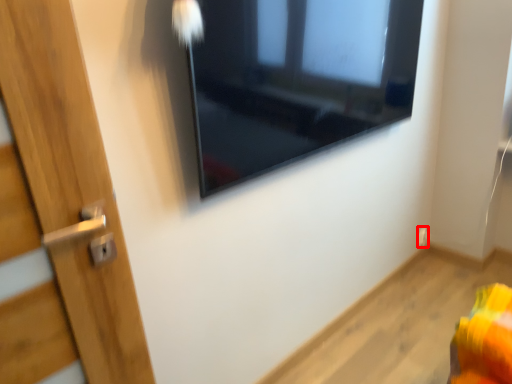
Question: From the image, what is the correct spatial relationship of electric outlet (annotated by the red box) in relation to window?

Choices:
 (A) left
 (B) right

Answer: (B)